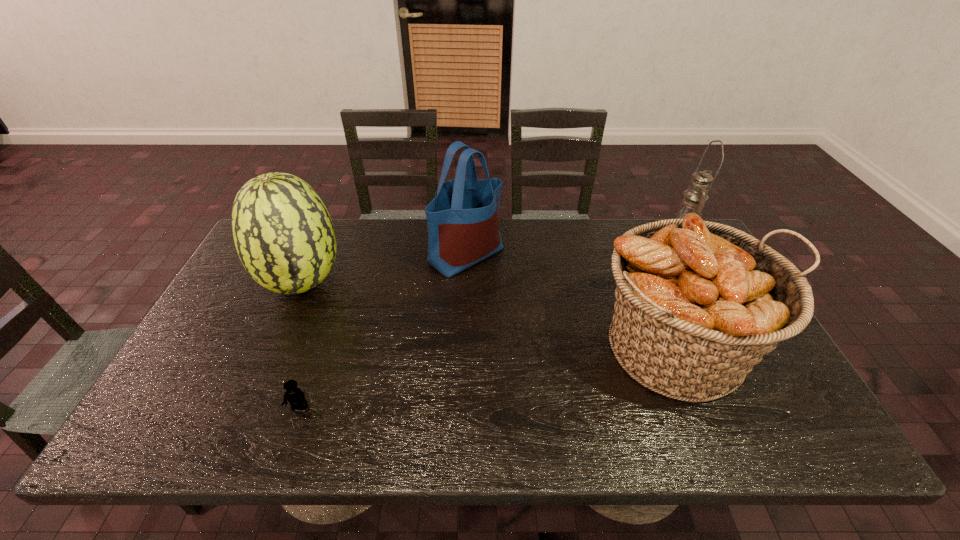
Find the location of `vacant area at the far edge of the desktop`. vacant area at the far edge of the desktop is located at coordinates (643, 224).

This screenshot has height=540, width=960. I want to click on free space at the near edge, so click(x=301, y=423).

Image resolution: width=960 pixels, height=540 pixels. Identify the location of blank space at the left edge. (261, 311).

Locate an element on the screen. blank space at the right edge of the desktop is located at coordinates pos(759,370).

Where is `vacant area that lies between the Lego and the watermelon`? This screenshot has width=960, height=540. vacant area that lies between the Lego and the watermelon is located at coordinates (301, 345).

The width and height of the screenshot is (960, 540). I want to click on vacant point located between the oil lamp and the handbag, so click(572, 249).

This screenshot has height=540, width=960. I want to click on vacant point located between the Lego and the basket, so click(x=489, y=377).

Where is `vacant space in between the basket and the third object from left to right`? vacant space in between the basket and the third object from left to right is located at coordinates (572, 301).

Where is `free spot between the watermelon and the basket`? This screenshot has height=540, width=960. free spot between the watermelon and the basket is located at coordinates (491, 315).

You are a GUI agent. You are given a task and a screenshot of the screen. Output one action in this format:
    pyautogui.click(x=<x>, y=<y>)
    Task: Click on the vacant region between the watermelon and the oil lamp
    
    Given the screenshot: What is the action you would take?
    pyautogui.click(x=491, y=264)